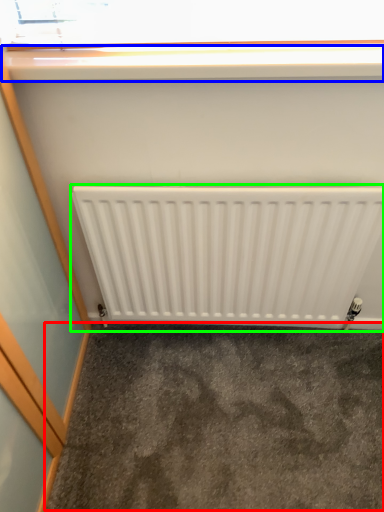
Question: Considering the real-world distances, which object is closest to concrete (highlighted by a red box)? window sill (highlighted by a blue box) or radiator (highlighted by a green box).

Choices:
 (A) window sill
 (B) radiator

Answer: (B)